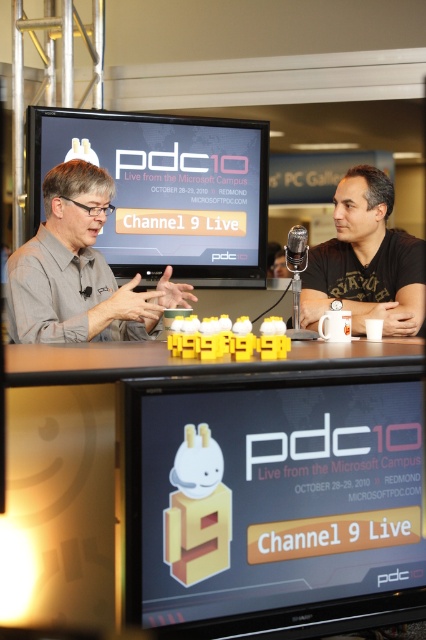
Question: Which point is closer to the camera?

Choices:
 (A) matte black screen at center
 (B) gray matte shirt at left
 (C) black matte t-shirt at right
 (D) matte black monitor at center

Answer: (A)

Question: Where is matte black monitor at center located in relation to black matte t-shirt at right in the image?

Choices:
 (A) left
 (B) right

Answer: (A)

Question: Which point is closer to the camera taking this photo?

Choices:
 (A) (353, 554)
 (B) (348, 232)
 (C) (285, 259)
 (D) (181, 243)

Answer: (A)

Question: Considering the real-world distances, which object is farthest from the matte black screen at center?

Choices:
 (A) black matte t-shirt at right
 (B) gray matte shirt at left
 (C) matte black monitor at center
 (D) black plastic microphone at center

Answer: (C)

Question: Considering the relative positions of matte black screen at center and black matte t-shirt at right in the image provided, where is matte black screen at center located with respect to black matte t-shirt at right?

Choices:
 (A) left
 (B) right

Answer: (A)

Question: Is black matte t-shirt at right positioned before black plastic microphone at center?

Choices:
 (A) yes
 (B) no

Answer: (B)